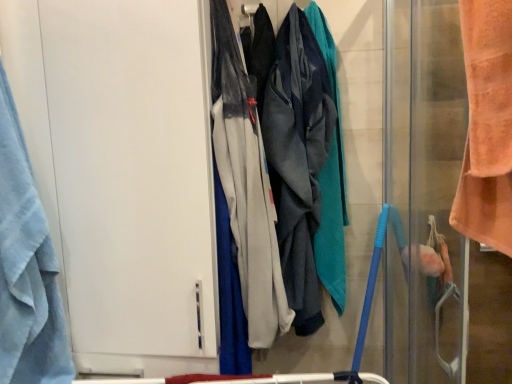
Question: Can you confirm if orange towel at right, which appears as the first screen door when viewed from the right, is shorter than blue terry cloth towel at left?

Choices:
 (A) no
 (B) yes

Answer: (A)

Question: From the image's perspective, is orange towel at right, which appears as the first screen door when viewed from the right, beneath blue terry cloth towel at left?

Choices:
 (A) yes
 (B) no

Answer: (A)

Question: Considering the relative sizes of orange towel at right, positioned as the second screen door in left-to-right order, and blue terry cloth towel at left in the image provided, is orange towel at right, positioned as the second screen door in left-to-right order, smaller than blue terry cloth towel at left?

Choices:
 (A) no
 (B) yes

Answer: (A)

Question: Is orange towel at right, positioned as the second screen door in left-to-right order, not within blue terry cloth towel at left?

Choices:
 (A) no
 (B) yes

Answer: (B)

Question: Is orange towel at right, positioned as the second screen door in left-to-right order, touching blue terry cloth towel at left?

Choices:
 (A) no
 (B) yes

Answer: (A)

Question: Does orange towel at right, which appears as the first screen door when viewed from the right, come behind blue terry cloth towel at left?

Choices:
 (A) no
 (B) yes

Answer: (A)

Question: Could you tell me if orange towel at right, positioned as the second screen door in left-to-right order, is facing textured gray hoodie at center, the first wide viewed from the back?

Choices:
 (A) yes
 (B) no

Answer: (A)

Question: Is orange towel at right, positioned as the second screen door in left-to-right order, at the right side of textured gray hoodie at center, which is the second wide from front to back?

Choices:
 (A) yes
 (B) no

Answer: (A)

Question: Does orange towel at right, which appears as the first screen door when viewed from the right, have a greater height compared to textured gray hoodie at center, which is the second wide from front to back?

Choices:
 (A) no
 (B) yes

Answer: (B)

Question: From the image's perspective, is orange towel at right, positioned as the second screen door in left-to-right order, on top of textured gray hoodie at center, the first wide viewed from the back?

Choices:
 (A) no
 (B) yes

Answer: (A)

Question: Can you confirm if orange towel at right, positioned as the second screen door in left-to-right order, is positioned to the left of textured gray hoodie at center, which is the second wide from front to back?

Choices:
 (A) no
 (B) yes

Answer: (A)

Question: Is orange towel at right, which appears as the first screen door when viewed from the right, shorter than textured gray hoodie at center, the first wide viewed from the back?

Choices:
 (A) no
 (B) yes

Answer: (A)

Question: Is blue terry cloth towel at left not inside white matte door at left, the second screen door when ordered from right to left?

Choices:
 (A) yes
 (B) no

Answer: (A)